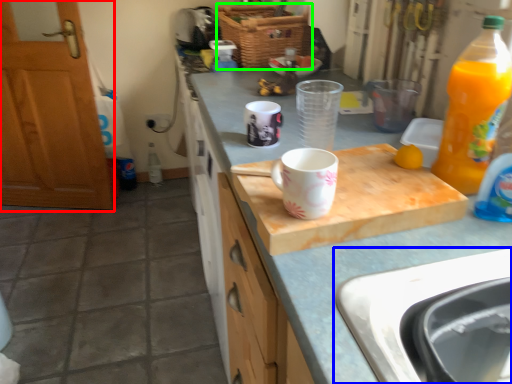
Question: Estimate the real-world distances between objects in this image. Which object is farther from cabinetry (highlighted by a red box), sink (highlighted by a blue box) or basket (highlighted by a green box)?

Choices:
 (A) sink
 (B) basket

Answer: (A)